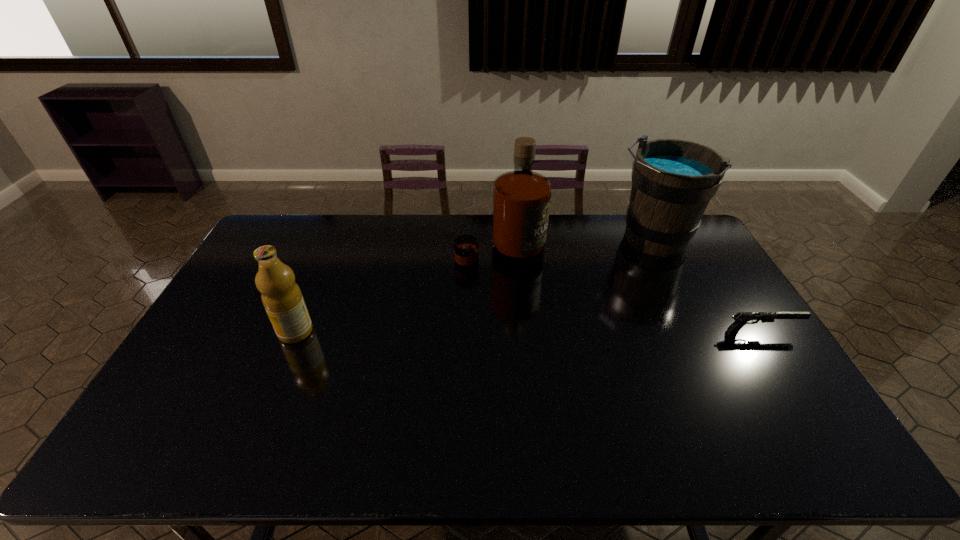
Locate an element on the screen. This screenshot has width=960, height=540. olive oil is located at coordinates (282, 298).

The width and height of the screenshot is (960, 540). What are the coordinates of `the second shortest object` in the screenshot? It's located at (282, 298).

Where is `the shortest object`? The width and height of the screenshot is (960, 540). the shortest object is located at coordinates (741, 318).

What are the coordinates of `liquor` in the screenshot? It's located at (521, 198).

What are the coordinates of `the third shortest object` in the screenshot? It's located at (673, 181).

Locate an element on the screen. vacant space located on the label of the olive oil is located at coordinates (218, 332).

Where is `vacant area situated on the front label of the second object from left to right`? vacant area situated on the front label of the second object from left to right is located at coordinates (528, 279).

The height and width of the screenshot is (540, 960). What are the coordinates of `blank area located 0.050m on the front label of the second object from left to right` in the screenshot? It's located at (526, 278).

At what (x,y) coordinates should I click in order to perform the action: click on vacant space located 0.300m on the front label of the second object from left to right. Please return your answer as a coordinate pair (x, y). The image size is (960, 540). Looking at the image, I should click on (566, 327).

Identify the location of free location located with a handle on the side of the wine bucket. (583, 321).